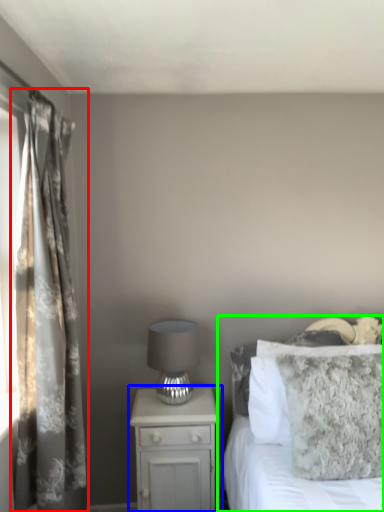
Question: Which object is positioned closest to curtain (highlighted by a red box)? Select from nightstand (highlighted by a blue box) and bed (highlighted by a green box).

Choices:
 (A) nightstand
 (B) bed

Answer: (A)